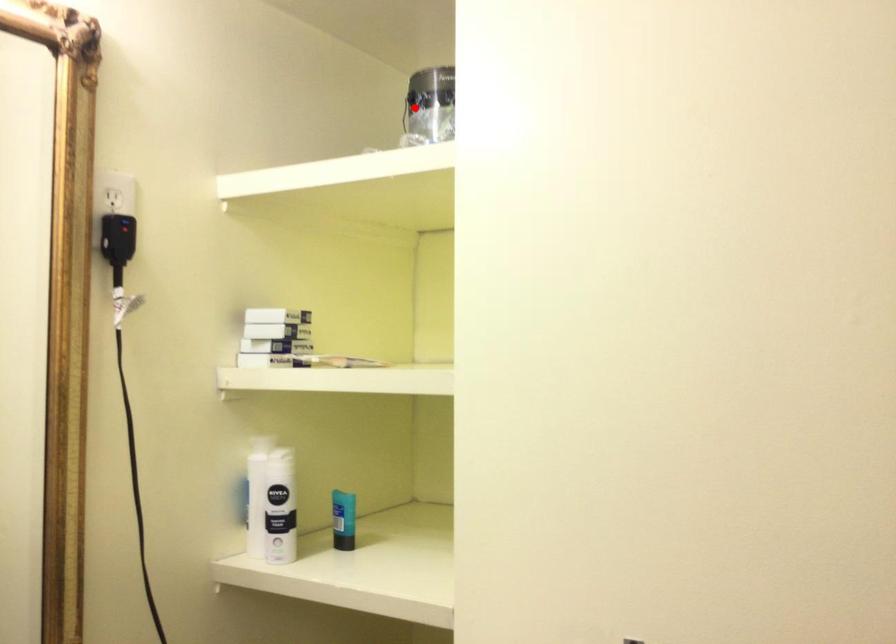
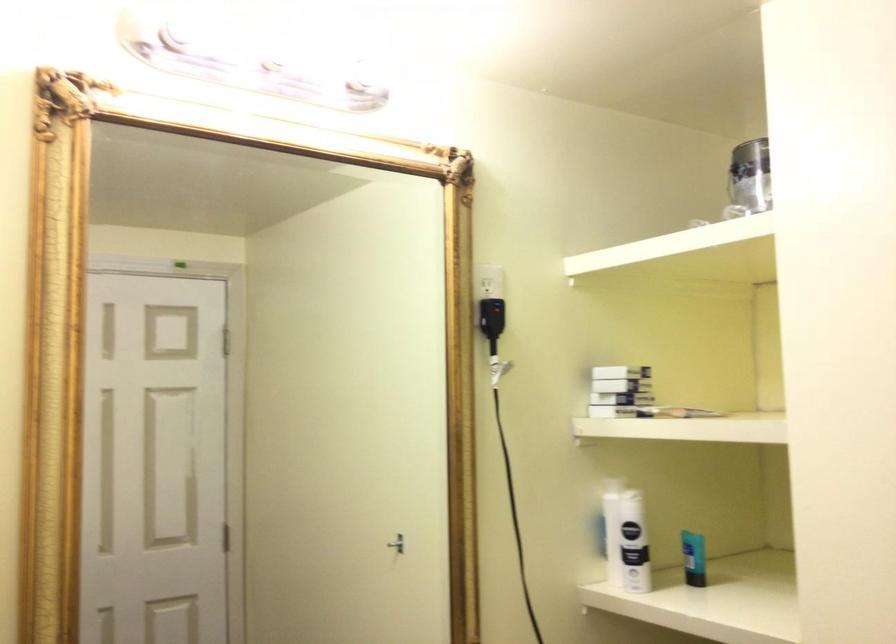
Question: I am providing you with two images of the same scene from different viewpoints. A red point is marked on the first image. Can you still see the location of the red point in image 2?

Choices:
 (A) Yes
 (B) No

Answer: (A)